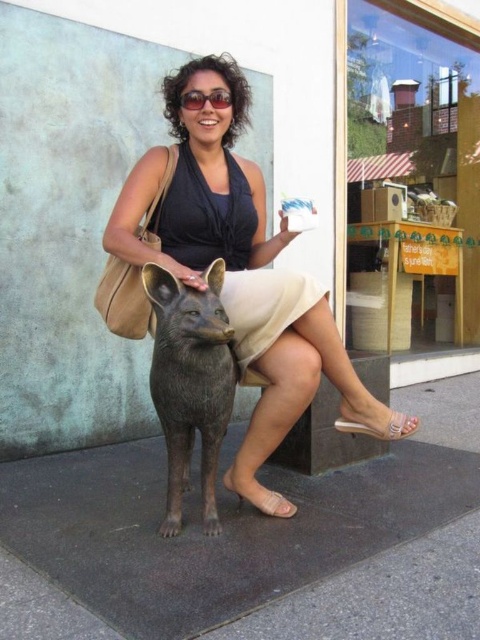
Question: Is bronze statue at center positioned at the back of beige satin dress at center?

Choices:
 (A) yes
 (B) no

Answer: (B)

Question: Which is nearer to the matte black dress at center?

Choices:
 (A) bronze statue at center
 (B) beige satin dress at center

Answer: (B)

Question: From the image, what is the correct spatial relationship of matte black dress at center in relation to bronze statue at center?

Choices:
 (A) left
 (B) right

Answer: (B)

Question: Which of the following is the closest to the observer?

Choices:
 (A) beige satin dress at center
 (B) matte black dress at center
 (C) bronze statue at center

Answer: (C)

Question: Is matte black dress at center positioned behind beige satin dress at center?

Choices:
 (A) no
 (B) yes

Answer: (A)

Question: Considering the real-world distances, which object is closest to the matte black dress at center?

Choices:
 (A) bronze statue at center
 (B) beige satin dress at center

Answer: (B)